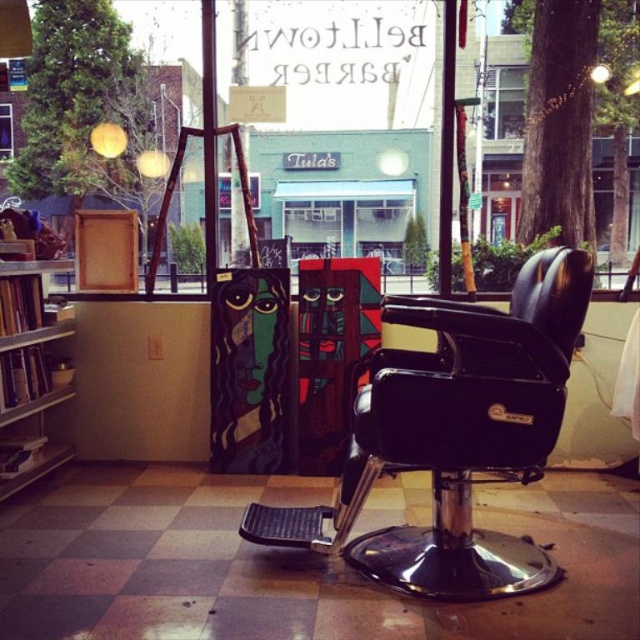
You are a customer entering the barbershop and want to sit in the black leather swivel chair at center. However, you notice the wooden bookshelf at left might be blocking your path. Can you walk directly to the chair without moving the shelf?

The black leather swivel chair at center is positioned under the wooden bookshelf at left, meaning the shelf is above the chair. Since the shelf is overhead, it does not block the path to the chair, so you can walk directly to the black leather swivel chair at center without moving the shelf.

You are standing outside the barbershop looking through the window. You see a point marked at coordinates (452, 435). What object is located at that point?

The point at coordinates (452, 435) indicates the location of the black leather swivel chair at center.